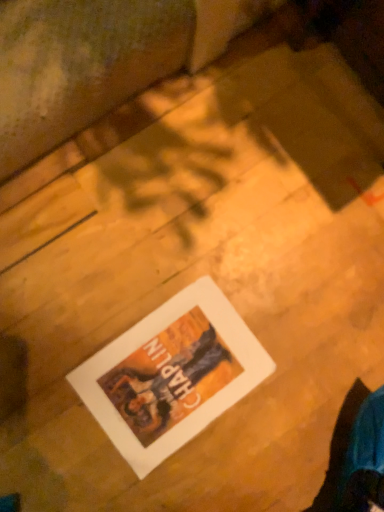
The width and height of the screenshot is (384, 512). What do you see at coordinates (171, 375) in the screenshot?
I see `matte paper poster at center` at bounding box center [171, 375].

Measure the distance between point (143, 376) and camera.

The depth of point (143, 376) is 29.13 inches.

What is the approximate width of matte paper poster at center?

11.48 inches.

The height and width of the screenshot is (512, 384). I want to click on matte paper poster at center, so click(171, 375).

This screenshot has height=512, width=384. What are the coordinates of `matte paper poster at center` in the screenshot? It's located at coord(171,375).